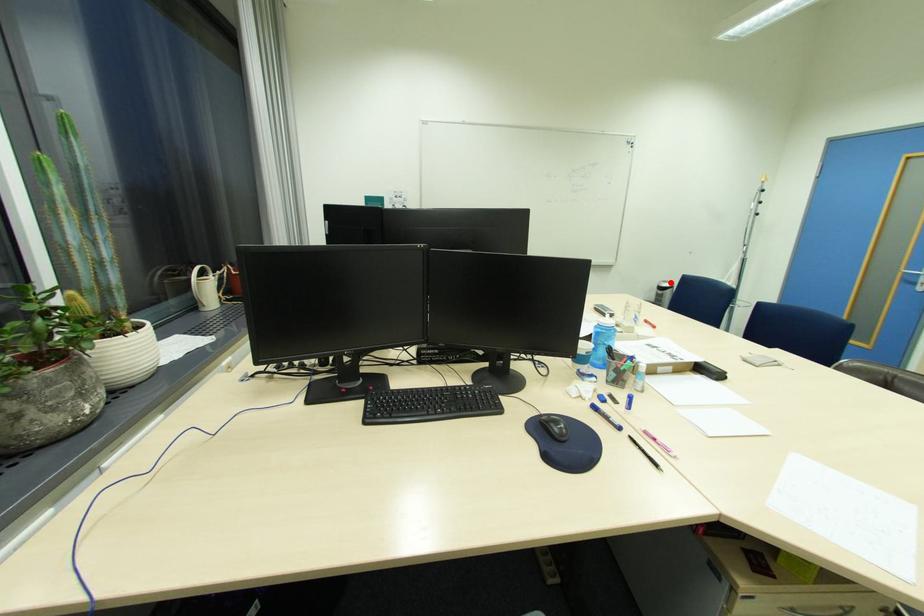
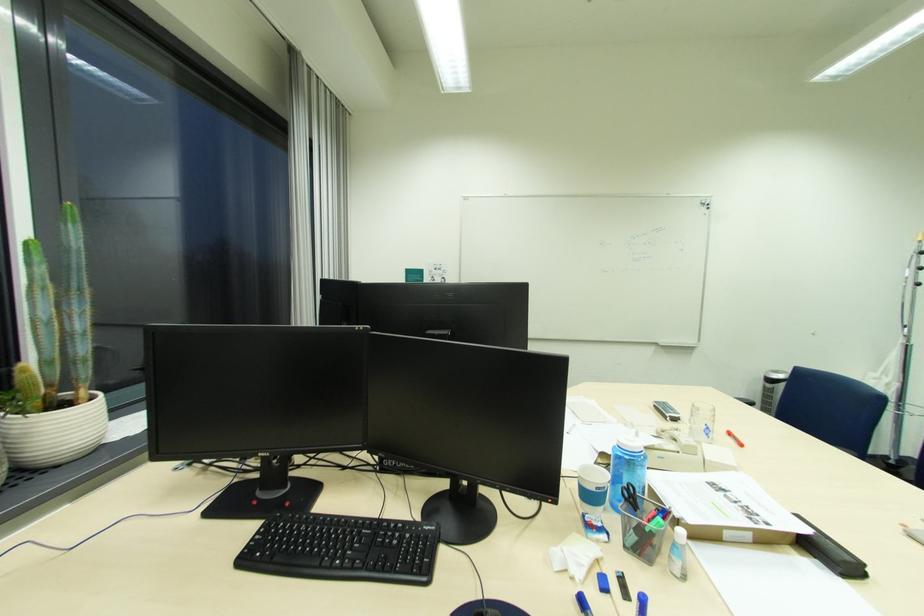
Find the pixel in the second image that matches the highlighted location in the first image.

(782, 373)